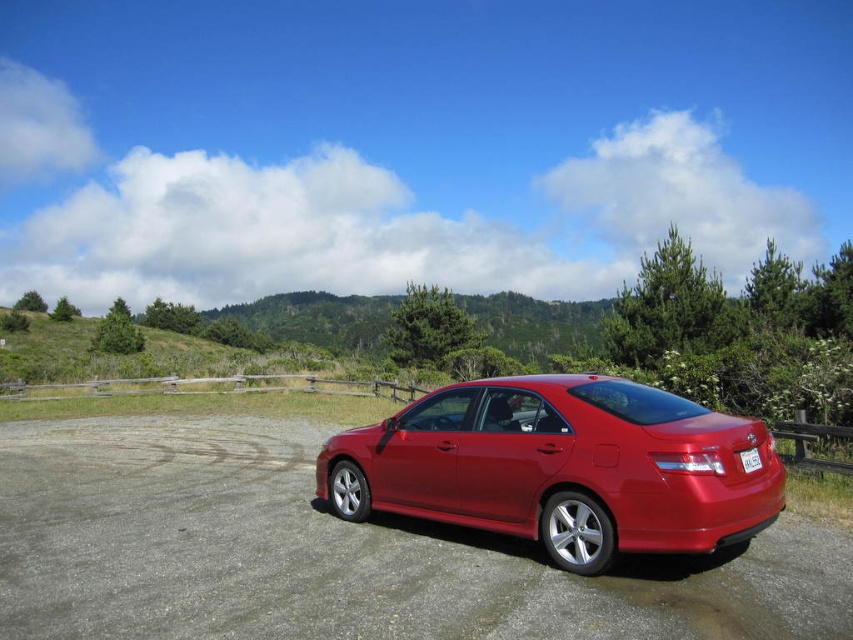
Question: Is glossy metallic sedan at center thinner than white plastic license plate at center?

Choices:
 (A) yes
 (B) no

Answer: (B)

Question: Observing the image, what is the correct spatial positioning of glossy metallic sedan at center in reference to white plastic license plate at center?

Choices:
 (A) right
 (B) left

Answer: (B)

Question: Does glossy metallic sedan at center lie behind white plastic license plate at center?

Choices:
 (A) no
 (B) yes

Answer: (A)

Question: Among these objects, which one is farthest from the camera?

Choices:
 (A) white plastic license plate at center
 (B) glossy metallic sedan at center

Answer: (A)